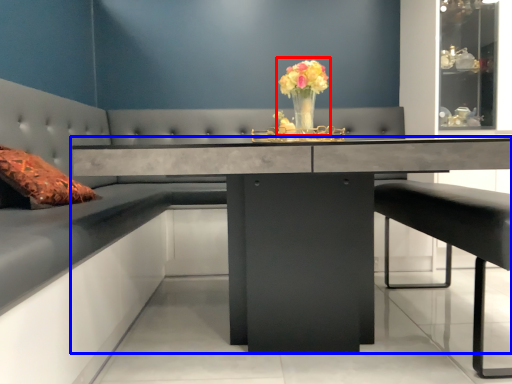
Question: Which of the following is the closest to the observer, floral arrangement (highlighted by a red box) or table (highlighted by a blue box)?

Choices:
 (A) floral arrangement
 (B) table

Answer: (B)